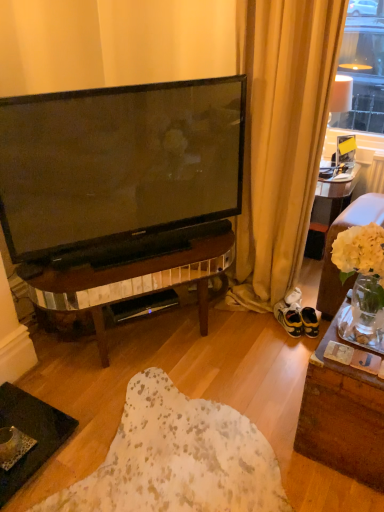
This screenshot has height=512, width=384. Find the location of `yellow suede sneakers at lower right`. yellow suede sneakers at lower right is located at coordinates (289, 318).

I want to click on beige fabric curtain at upper right, so click(281, 138).

Describe the element at coordinates (281, 138) in the screenshot. I see `beige fabric curtain at upper right` at that location.

Find the location of a particular element. black plastic speaker at center is located at coordinates (143, 305).

From the image's perspective, which is below, yellow suede sneakers at lower right or black plastic speaker at center?

From the image's view, yellow suede sneakers at lower right is below.

Which of these two, yellow suede sneakers at lower right or black plastic speaker at center, stands taller?

Standing taller between the two is yellow suede sneakers at lower right.

You are a GUI agent. You are given a task and a screenshot of the screen. Output one action in this format:
    pyautogui.click(x=<x>, y=<y>)
    Task: Click on the footwear beneath the black plastic speaker at center (from a real-world perspective)
    
    Given the screenshot: What is the action you would take?
    pyautogui.click(x=289, y=318)

Consider the image. From a real-world perspective, which object rests below the other?

yellow suede sneakers at lower right is physically lower.

Consider the image. Considering the relative sizes of beige fabric curtain at upper right and black plastic speaker at center in the image provided, is beige fabric curtain at upper right smaller than black plastic speaker at center?

No, beige fabric curtain at upper right is not smaller than black plastic speaker at center.

Which of these two, beige fabric curtain at upper right or black plastic speaker at center, is wider?

With larger width is black plastic speaker at center.

Is beige fabric curtain at upper right not inside black plastic speaker at center?

Absolutely, beige fabric curtain at upper right is external to black plastic speaker at center.

Identify the location of footwear beneath the beige fabric curtain at upper right (from a real-world perspective). The width and height of the screenshot is (384, 512). click(x=289, y=318).

Can you tell me how much yellow suede sneakers at lower right and beige fabric curtain at upper right differ in facing direction?

The angular difference between yellow suede sneakers at lower right and beige fabric curtain at upper right is 42.8 degrees.

Is yellow suede sneakers at lower right wider than beige fabric curtain at upper right?

Incorrect, the width of yellow suede sneakers at lower right does not surpass that of beige fabric curtain at upper right.

Is yellow suede sneakers at lower right inside the boundaries of beige fabric curtain at upper right, or outside?

yellow suede sneakers at lower right is located inside beige fabric curtain at upper right.

Based on the photo, how different are the orientations of suede brown couch at right and beige fabric curtain at upper right in degrees?

The angular difference between suede brown couch at right and beige fabric curtain at upper right is 1.62 degrees.

Can you confirm if suede brown couch at right is wider than beige fabric curtain at upper right?

Yes, suede brown couch at right is wider than beige fabric curtain at upper right.

From a real-world perspective, is suede brown couch at right above or below beige fabric curtain at upper right?

Clearly, from a real-world perspective, suede brown couch at right is below beige fabric curtain at upper right.

You are a GUI agent. You are given a task and a screenshot of the screen. Output one action in this format:
    pyautogui.click(x=<x>, y=<y>)
    Task: Click on the studio couch in front of the beige fabric curtain at upper right
    This screenshot has width=384, height=512.
    Given the screenshot: What is the action you would take?
    pyautogui.click(x=331, y=250)

Who is smaller, black plastic speaker at center or suede brown couch at right?

black plastic speaker at center.

Image resolution: width=384 pixels, height=512 pixels. I want to click on loudspeaker that is below the suede brown couch at right (from the image's perspective), so click(x=143, y=305).

Is suede brown couch at right a part of black plastic speaker at center?

No, suede brown couch at right is not a part of black plastic speaker at center.

From their relative heights in the image, would you say black plastic speaker at center is taller or shorter than suede brown couch at right?

Considering their sizes, black plastic speaker at center has less height than suede brown couch at right.

Would you say suede brown couch at right is inside or outside black plastic speaker at center?

suede brown couch at right lies outside black plastic speaker at center.

Is suede brown couch at right directly adjacent to black plastic speaker at center?

No, suede brown couch at right is not with black plastic speaker at center.

Considering the positions of point (372, 217) and point (171, 297), is point (372, 217) closer or farther from the camera than point (171, 297)?

Clearly, point (372, 217) is closer to the camera than point (171, 297).

Is suede brown couch at right closer to the viewer compared to black plastic speaker at center?

Yes, it is.

Is point (267, 190) positioned after point (332, 298)?

No, (267, 190) is in front of (332, 298).

Between beige fabric curtain at upper right and suede brown couch at right, which one has larger size?

With larger size is beige fabric curtain at upper right.

Looking at their sizes, would you say beige fabric curtain at upper right is wider or thinner than suede brown couch at right?

Clearly, beige fabric curtain at upper right has less width compared to suede brown couch at right.

Considering the relative sizes of beige fabric curtain at upper right and suede brown couch at right in the image provided, is beige fabric curtain at upper right shorter than suede brown couch at right?

Incorrect, the height of beige fabric curtain at upper right does not fall short of that of suede brown couch at right.

Find the location of a particular element. This screenshot has height=512, width=384. footwear located below the black plastic speaker at center (from the image's perspective) is located at coordinates (289, 318).

Locate an element on the screen. The height and width of the screenshot is (512, 384). curtain above the black plastic speaker at center (from the image's perspective) is located at coordinates (281, 138).

Based on their spatial positions, is black plastic speaker at center or beige fabric curtain at upper right closer to yellow suede sneakers at lower right?

beige fabric curtain at upper right is positioned closer to the anchor yellow suede sneakers at lower right.

Looking at the image, which one is located further to beige fabric curtain at upper right, suede brown couch at right or black plastic speaker at center?

black plastic speaker at center.

From the image, which object appears to be nearer to black plastic speaker at center, yellow suede sneakers at lower right or beige fabric curtain at upper right?

Among the two, yellow suede sneakers at lower right is located nearer to black plastic speaker at center.

When comparing their distances from black plastic speaker at center, does yellow suede sneakers at lower right or suede brown couch at right seem closer?

The object closer to black plastic speaker at center is yellow suede sneakers at lower right.

From the image, which object appears to be nearer to beige fabric curtain at upper right, suede brown couch at right or yellow suede sneakers at lower right?

suede brown couch at right lies closer to beige fabric curtain at upper right than the other object.

When comparing their distances from beige fabric curtain at upper right, does yellow suede sneakers at lower right or suede brown couch at right seem closer?

The object closer to beige fabric curtain at upper right is suede brown couch at right.

When comparing their distances from beige fabric curtain at upper right, does yellow suede sneakers at lower right or black plastic speaker at center seem closer?

yellow suede sneakers at lower right.

Considering their positions, is beige fabric curtain at upper right positioned closer to yellow suede sneakers at lower right than black plastic speaker at center?

The object closer to yellow suede sneakers at lower right is beige fabric curtain at upper right.

You are a GUI agent. You are given a task and a screenshot of the screen. Output one action in this format:
    pyautogui.click(x=<x>, y=<y>)
    Task: Click on the curtain situated between black plastic speaker at center and suede brown couch at right from left to right
    
    Given the screenshot: What is the action you would take?
    pyautogui.click(x=281, y=138)

Locate an element on the screen. This screenshot has height=512, width=384. curtain between black plastic speaker at center and yellow suede sneakers at lower right in the horizontal direction is located at coordinates (281, 138).

You are a GUI agent. You are given a task and a screenshot of the screen. Output one action in this format:
    pyautogui.click(x=<x>, y=<y>)
    Task: Click on the loudspeaker between suede brown couch at right and yellow suede sneakers at lower right along the z-axis
    
    Given the screenshot: What is the action you would take?
    pyautogui.click(x=143, y=305)

I want to click on curtain between suede brown couch at right and yellow suede sneakers at lower right in the front-back direction, so click(x=281, y=138).